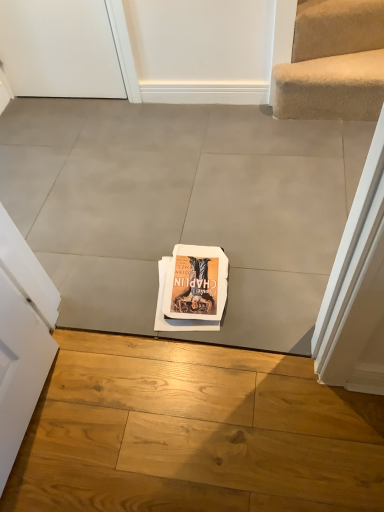
Question: Is gray concrete at center, the 2th concrete positioned from the front, not within matte paper book at center?

Choices:
 (A) yes
 (B) no

Answer: (A)

Question: From a real-world perspective, is gray concrete at center, the 2th concrete positioned from the front, positioned over matte paper book at center based on gravity?

Choices:
 (A) no
 (B) yes

Answer: (B)

Question: Can you see gray concrete at center, which ranks as the 1th concrete in back-to-front order, touching matte paper book at center?

Choices:
 (A) yes
 (B) no

Answer: (B)

Question: Does gray concrete at center, which ranks as the 1th concrete in back-to-front order, turn towards matte paper book at center?

Choices:
 (A) no
 (B) yes

Answer: (B)

Question: From the image's perspective, relative to gray tile floor at center, which is the first concrete in front-to-back order, is white matte door at upper left above or below?

Choices:
 (A) above
 (B) below

Answer: (A)

Question: Is point (84, 74) closer or farther from the camera than point (89, 458)?

Choices:
 (A) farther
 (B) closer

Answer: (A)

Question: In the image, is white matte door at upper left positioned in front of or behind gray tile floor at center, marked as the 1th concrete in a bottom-to-top arrangement?

Choices:
 (A) behind
 (B) front

Answer: (A)

Question: From their relative heights in the image, would you say white matte door at upper left is taller or shorter than gray tile floor at center, which is the first concrete in front-to-back order?

Choices:
 (A) short
 (B) tall

Answer: (B)

Question: Is gray concrete at center, which ranks as the 1th concrete in back-to-front order, to the left or to the right of gray tile floor at center, the 2th concrete from the back, in the image?

Choices:
 (A) right
 (B) left

Answer: (B)

Question: Is gray concrete at center, the second concrete when ordered from bottom to top, wider or thinner than gray tile floor at center, marked as the 1th concrete in a bottom-to-top arrangement?

Choices:
 (A) wide
 (B) thin

Answer: (A)

Question: Relative to gray tile floor at center, the 2th concrete from the back, is gray concrete at center, the 2th concrete positioned from the front, in front or behind?

Choices:
 (A) front
 (B) behind

Answer: (B)

Question: From the image's perspective, is gray concrete at center, which ranks as the 1th concrete in back-to-front order, positioned above or below gray tile floor at center, the second concrete in the top-to-bottom sequence?

Choices:
 (A) above
 (B) below

Answer: (A)

Question: Is gray concrete at center, the 2th concrete positioned from the front, taller or shorter than white matte door at upper left?

Choices:
 (A) tall
 (B) short

Answer: (B)

Question: From a real-world perspective, relative to white matte door at upper left, is gray concrete at center, which ranks as the 1th concrete in back-to-front order, vertically above or below?

Choices:
 (A) above
 (B) below

Answer: (B)